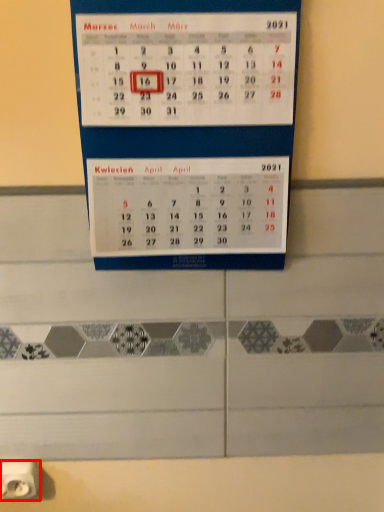
Question: From the image's perspective, what is the correct spatial relationship of power plugs and sockets (annotated by the red box) in relation to bulletin board?

Choices:
 (A) above
 (B) below

Answer: (B)